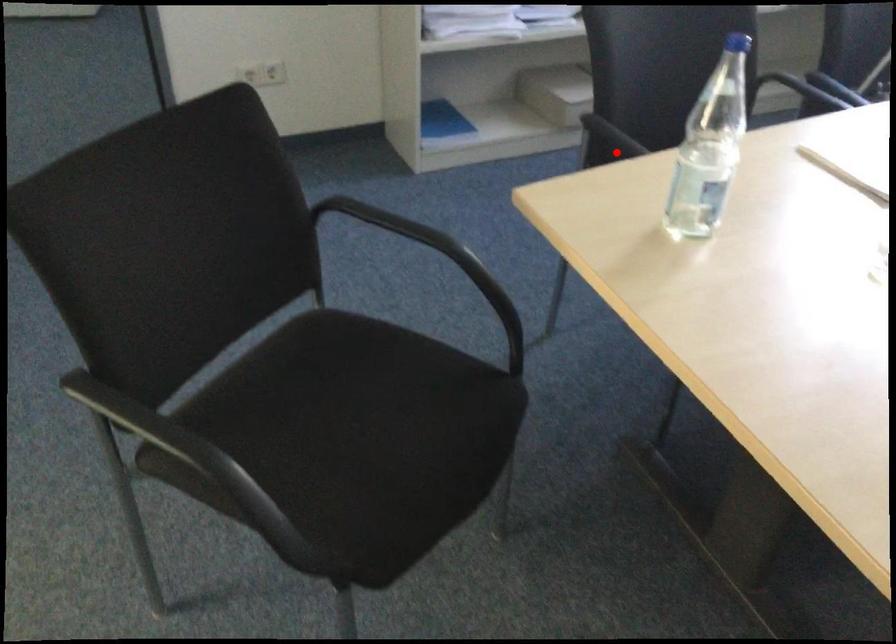
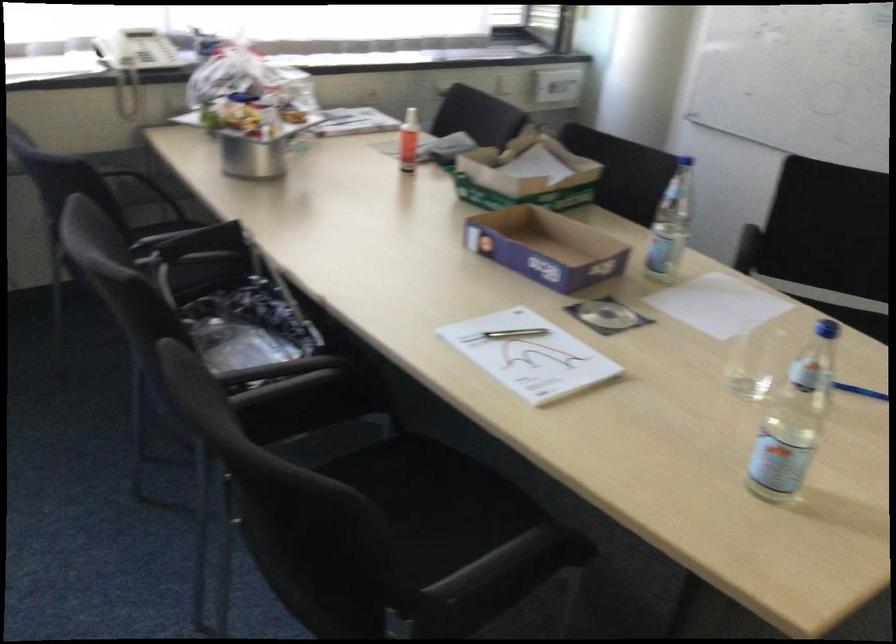
Locate, in the second image, the point that corresponds to the highlighted location in the first image.

(513, 553)